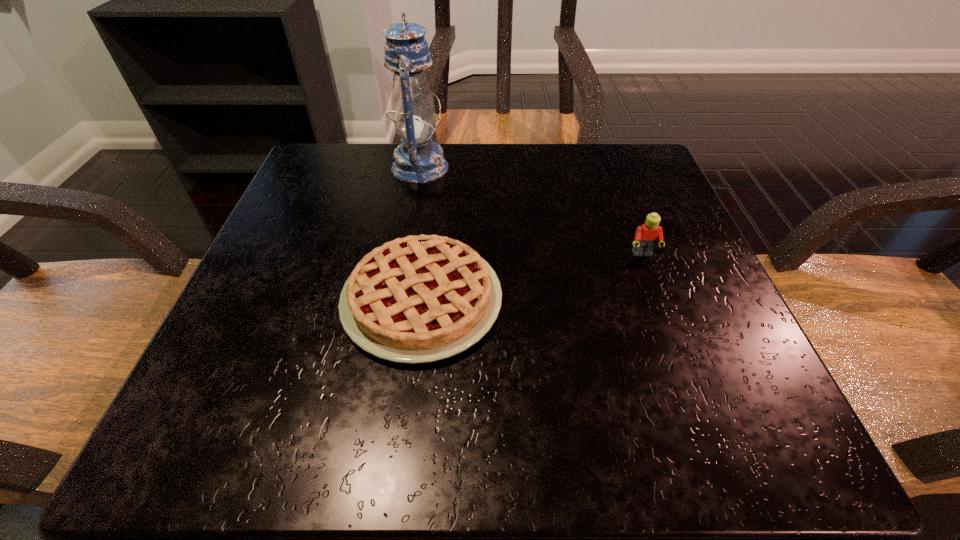
Image resolution: width=960 pixels, height=540 pixels. Identify the location of object at the right edge. (646, 236).

In the image, there is a desktop. At what (x,y) coordinates should I click in order to perform the action: click on blank space at the far edge. Please return your answer as a coordinate pair (x, y). Looking at the image, I should click on (517, 159).

This screenshot has height=540, width=960. In order to click on vacant space at the near edge in this screenshot , I will do `click(607, 410)`.

In the image, there is a desktop. At what (x,y) coordinates should I click in order to perform the action: click on vacant space at the left edge. Please return your answer as a coordinate pair (x, y). Looking at the image, I should click on (300, 379).

Locate an element on the screen. vacant space at the right edge is located at coordinates (636, 228).

This screenshot has height=540, width=960. I want to click on vacant area at the far left corner, so click(362, 161).

You are a GUI agent. You are given a task and a screenshot of the screen. Output one action in this format:
    pyautogui.click(x=<x>, y=<y>)
    Task: Click on the free space at the far right corner of the desktop
    
    Given the screenshot: What is the action you would take?
    pyautogui.click(x=586, y=144)

The height and width of the screenshot is (540, 960). In the image, there is a desktop. Find the location of `free space at the near right corner`. free space at the near right corner is located at coordinates (646, 410).

I want to click on empty space that is in between the second shortest object and the tallest object, so click(531, 211).

Find the location of a particular element. The width and height of the screenshot is (960, 540). vacant area that lies between the second tallest object and the shortest object is located at coordinates (532, 277).